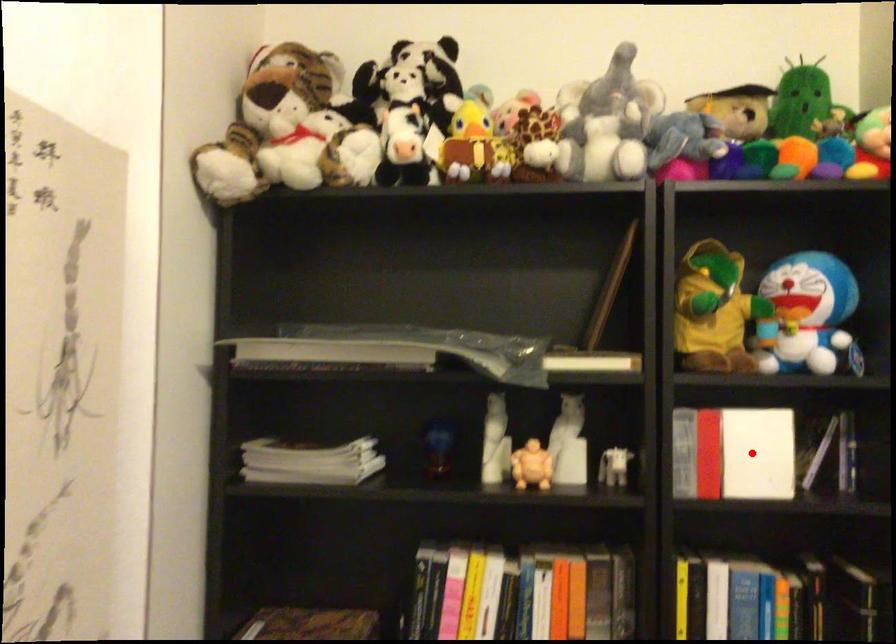
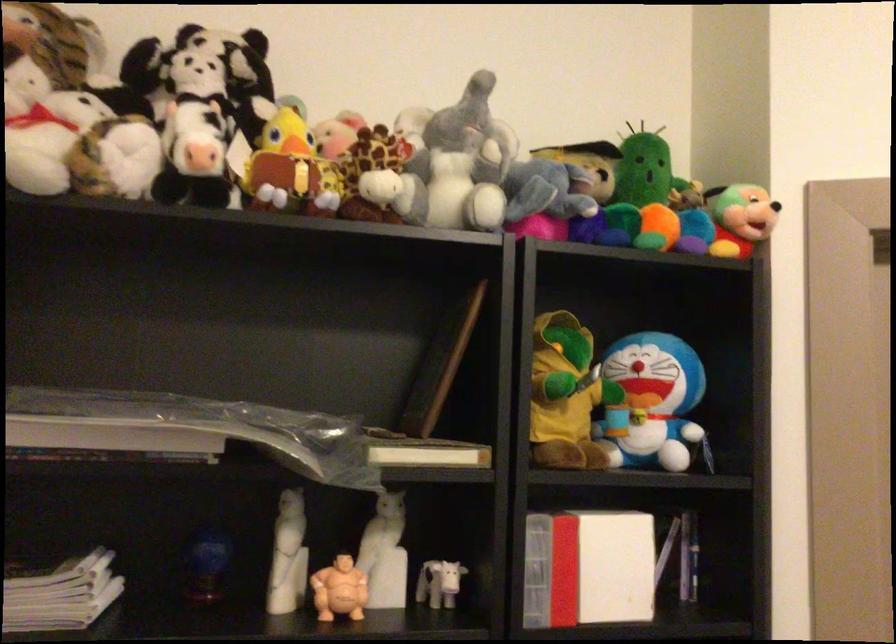
Question: I am providing you with two images of the same scene from different viewpoints. In image1, a red point is highlighted. Considering the same 3D point in image2, which of the following is correct?

Choices:
 (A) It is closer
 (B) It is farther

Answer: (A)